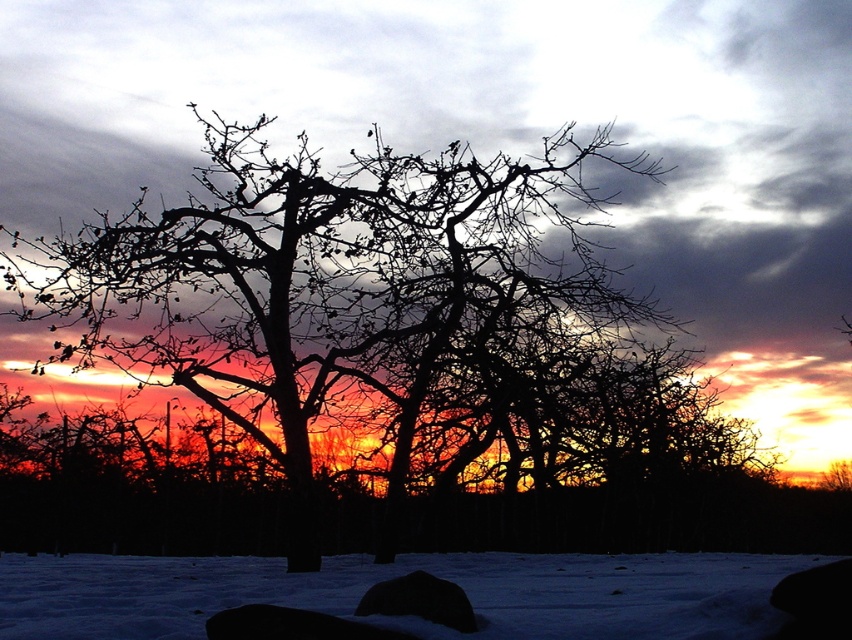
Is black silhouette tree at center bigger than white powdery snow at lower center?

Yes, black silhouette tree at center is bigger than white powdery snow at lower center.

Who is shorter, black silhouette tree at center or white powdery snow at lower center?

white powdery snow at lower center

Which is in front, point (494, 164) or point (574, 634)?

Point (574, 634) is in front.

In order to click on black silhouette tree at center in this screenshot , I will do `click(377, 316)`.